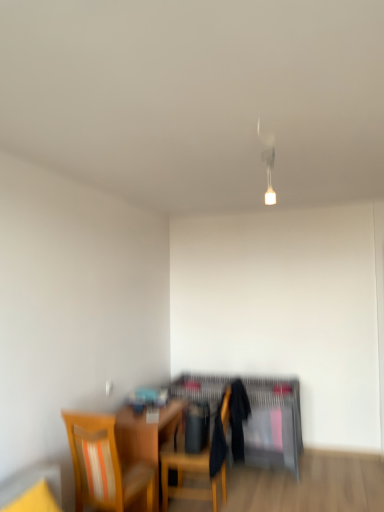
Question: Is wooden chair at center, the second chair viewed from the left, inside wooden table at center?

Choices:
 (A) yes
 (B) no

Answer: (B)

Question: From the image's perspective, is wooden table at center on top of wooden chair at center, which is counted as the second chair, starting from the front?

Choices:
 (A) no
 (B) yes

Answer: (A)

Question: Considering the relative sizes of wooden table at center and wooden chair at center, the first chair in the back-to-front sequence, in the image provided, is wooden table at center thinner than wooden chair at center, the first chair in the back-to-front sequence,?

Choices:
 (A) yes
 (B) no

Answer: (A)

Question: Does wooden table at center have a larger size compared to wooden chair at center, the first chair in the back-to-front sequence?

Choices:
 (A) yes
 (B) no

Answer: (B)

Question: Is wooden table at center shorter than wooden chair at center, which is counted as the second chair, starting from the front?

Choices:
 (A) yes
 (B) no

Answer: (A)

Question: Does wooden table at center turn towards wooden chair at center, placed as the first chair when sorted from right to left?

Choices:
 (A) yes
 (B) no

Answer: (A)

Question: Considering the relative sizes of wooden table at center and matte black desk at center in the image provided, is wooden table at center smaller than matte black desk at center?

Choices:
 (A) yes
 (B) no

Answer: (A)

Question: Does wooden table at center appear on the right side of matte black desk at center?

Choices:
 (A) yes
 (B) no

Answer: (B)

Question: Is wooden table at center shorter than matte black desk at center?

Choices:
 (A) yes
 (B) no

Answer: (A)

Question: Can you confirm if wooden table at center is thinner than matte black desk at center?

Choices:
 (A) yes
 (B) no

Answer: (A)

Question: Could you tell me if wooden table at center is turned towards matte black desk at center?

Choices:
 (A) yes
 (B) no

Answer: (B)

Question: From a real-world perspective, is wooden table at center under matte black desk at center?

Choices:
 (A) yes
 (B) no

Answer: (A)

Question: Does wooden chair with striped cushion at lower left, acting as the second chair starting from the right, have a lesser height compared to matte black desk at center?

Choices:
 (A) yes
 (B) no

Answer: (B)